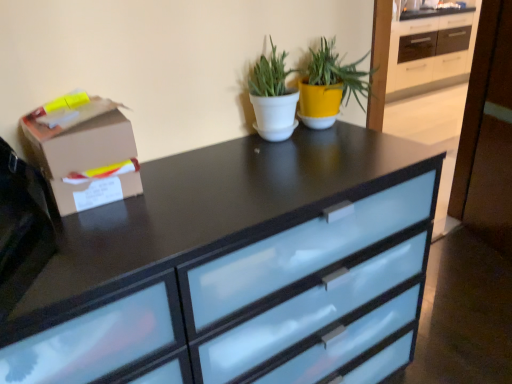
At what (x,y) coordinates should I click in order to perform the action: click on yellow matte pot at upper center, the 2th houseplant positioned from the left. Please return your answer as a coordinate pair (x, y). Looking at the image, I should click on (330, 82).

What is the approximate width of brown cardboard box at left?

It is 4.96 inches.

The image size is (512, 384). Describe the element at coordinates (238, 268) in the screenshot. I see `satin black chest of drawers at center` at that location.

You are a GUI agent. You are given a task and a screenshot of the screen. Output one action in this format:
    pyautogui.click(x=<x>, y=<y>)
    Task: Click on the yellow matte pot at upper center, the 2th houseplant positioned from the left
    The height and width of the screenshot is (384, 512).
    Given the screenshot: What is the action you would take?
    pyautogui.click(x=330, y=82)

I want to click on the 2nd houseplant behind the brown cardboard box at left, starting your count from the anchor, so click(330, 82).

Is yellow matte pot at upper center, the first houseplant in the right-to-left sequence, facing towards brown cardboard box at left?

No, yellow matte pot at upper center, the first houseplant in the right-to-left sequence, is not oriented towards brown cardboard box at left.

Looking at this image, which is less distant, (355, 93) or (57, 137)?

The point (57, 137) is in front.

Based on the photo, how distant is satin black chest of drawers at center from brown cardboard box at left?

A distance of 14.81 inches exists between satin black chest of drawers at center and brown cardboard box at left.

Is satin black chest of drawers at center at the right side of brown cardboard box at left?

Yes, satin black chest of drawers at center is to the right of brown cardboard box at left.

Is satin black chest of drawers at center in front of brown cardboard box at left?

Yes, satin black chest of drawers at center is closer to the viewer.

Is satin black chest of drawers at center taller or shorter than brown cardboard box at left?

Clearly, satin black chest of drawers at center is taller compared to brown cardboard box at left.

How different are the orientations of satin black chest of drawers at center and white matte pot at center, the second houseplant viewed from the right, in degrees?

satin black chest of drawers at center and white matte pot at center, the second houseplant viewed from the right, are facing 0.225 degrees away from each other.

Is point (65, 249) more distant than point (289, 92)?

No, (65, 249) is closer to viewer.

Does satin black chest of drawers at center have a greater height compared to white matte pot at center, which is counted as the first houseplant, starting from the left?

Yes.

Is satin black chest of drawers at center at the left side of white matte pot at center, the second houseplant viewed from the right?

Yes.

Where is `houseplant located above the white matte pot at center, the second houseplant viewed from the right (from a real-world perspective)`? houseplant located above the white matte pot at center, the second houseplant viewed from the right (from a real-world perspective) is located at coordinates (330, 82).

In the image, is white matte pot at center, the second houseplant viewed from the right, positioned in front of or behind yellow matte pot at upper center, the first houseplant in the right-to-left sequence?

white matte pot at center, the second houseplant viewed from the right, is positioned closer to the viewer than yellow matte pot at upper center, the first houseplant in the right-to-left sequence.

Which of these two, white matte pot at center, which is counted as the first houseplant, starting from the left, or yellow matte pot at upper center, the 2th houseplant positioned from the left, is thinner?

white matte pot at center, which is counted as the first houseplant, starting from the left, is thinner.

Does white matte pot at center, the second houseplant viewed from the right, have a larger size compared to yellow matte pot at upper center, the 2th houseplant positioned from the left?

No.

Identify the location of chest of drawers below the yellow matte pot at upper center, the first houseplant in the right-to-left sequence (from a real-world perspective). Image resolution: width=512 pixels, height=384 pixels. (238, 268).

Does point (396, 148) come closer to viewer compared to point (316, 115)?

No, it is not.

Considering the relative sizes of satin black chest of drawers at center and yellow matte pot at upper center, the 2th houseplant positioned from the left, in the image provided, is satin black chest of drawers at center shorter than yellow matte pot at upper center, the 2th houseplant positioned from the left,?

In fact, satin black chest of drawers at center may be taller than yellow matte pot at upper center, the 2th houseplant positioned from the left.

From a real-world perspective, which is physically below, satin black chest of drawers at center or yellow matte pot at upper center, the 2th houseplant positioned from the left?

From a 3D spatial view, satin black chest of drawers at center is below.

Is yellow matte pot at upper center, the first houseplant in the right-to-left sequence, wider than satin black chest of drawers at center?

No.

Which is behind, point (314, 55) or point (81, 315)?

The point (314, 55) is farther from the camera.

Is yellow matte pot at upper center, the first houseplant in the right-to-left sequence, completely or partially outside of satin black chest of drawers at center?

Yes, yellow matte pot at upper center, the first houseplant in the right-to-left sequence, is outside of satin black chest of drawers at center.

Who is smaller, yellow matte pot at upper center, the 2th houseplant positioned from the left, or satin black chest of drawers at center?

yellow matte pot at upper center, the 2th houseplant positioned from the left, is smaller.

Between brown cardboard box at left and white matte pot at center, the second houseplant viewed from the right, which one has smaller size?

white matte pot at center, the second houseplant viewed from the right, is smaller.

Would you say brown cardboard box at left is to the left or to the right of white matte pot at center, the second houseplant viewed from the right, in the picture?

In the image, brown cardboard box at left appears on the left side of white matte pot at center, the second houseplant viewed from the right.

From the image's perspective, is brown cardboard box at left positioned above or below white matte pot at center, the second houseplant viewed from the right?

brown cardboard box at left is situated lower than white matte pot at center, the second houseplant viewed from the right, in the image.

Locate an element on the screen. the 1st houseplant above the brown cardboard box at left (from a real-world perspective) is located at coordinates (272, 96).

The height and width of the screenshot is (384, 512). I want to click on the 2nd houseplant to the right when counting from the brown cardboard box at left, so click(330, 82).

This screenshot has width=512, height=384. Find the location of `cardboard box that is above the satin black chest of drawers at center (from a real-world perspective)`. cardboard box that is above the satin black chest of drawers at center (from a real-world perspective) is located at coordinates (85, 153).

Based on their spatial positions, is satin black chest of drawers at center or yellow matte pot at upper center, the first houseplant in the right-to-left sequence, further from white matte pot at center, the second houseplant viewed from the right?

satin black chest of drawers at center is positioned further to the anchor white matte pot at center, the second houseplant viewed from the right.

When comparing their distances from yellow matte pot at upper center, the 2th houseplant positioned from the left, does white matte pot at center, the second houseplant viewed from the right, or brown cardboard box at left seem further?

brown cardboard box at left lies further to yellow matte pot at upper center, the 2th houseplant positioned from the left, than the other object.

Based on their spatial positions, is yellow matte pot at upper center, the 2th houseplant positioned from the left, or white matte pot at center, the second houseplant viewed from the right, further from brown cardboard box at left?

yellow matte pot at upper center, the 2th houseplant positioned from the left, is positioned further to the anchor brown cardboard box at left.

Based on their spatial positions, is brown cardboard box at left or white matte pot at center, which is counted as the first houseplant, starting from the left, further from yellow matte pot at upper center, the first houseplant in the right-to-left sequence?

brown cardboard box at left is positioned further to the anchor yellow matte pot at upper center, the first houseplant in the right-to-left sequence.

Based on their spatial positions, is white matte pot at center, the second houseplant viewed from the right, or yellow matte pot at upper center, the first houseplant in the right-to-left sequence, closer to brown cardboard box at left?

white matte pot at center, the second houseplant viewed from the right.

Estimate the real-world distances between objects in this image. Which object is further from satin black chest of drawers at center, yellow matte pot at upper center, the first houseplant in the right-to-left sequence, or brown cardboard box at left?

The object further to satin black chest of drawers at center is yellow matte pot at upper center, the first houseplant in the right-to-left sequence.

Estimate the real-world distances between objects in this image. Which object is closer to white matte pot at center, the second houseplant viewed from the right, brown cardboard box at left or yellow matte pot at upper center, the 2th houseplant positioned from the left?

Based on the image, yellow matte pot at upper center, the 2th houseplant positioned from the left, appears to be nearer to white matte pot at center, the second houseplant viewed from the right.

From the image, which object appears to be farther from brown cardboard box at left, yellow matte pot at upper center, the 2th houseplant positioned from the left, or satin black chest of drawers at center?

The object further to brown cardboard box at left is yellow matte pot at upper center, the 2th houseplant positioned from the left.

At what (x,y) coordinates should I click in order to perform the action: click on cardboard box between yellow matte pot at upper center, the first houseplant in the right-to-left sequence, and satin black chest of drawers at center from top to bottom. Please return your answer as a coordinate pair (x, y). Looking at the image, I should click on (85, 153).

You are a GUI agent. You are given a task and a screenshot of the screen. Output one action in this format:
    pyautogui.click(x=<x>, y=<y>)
    Task: Click on the houseplant situated between brown cardboard box at left and yellow matte pot at upper center, the 2th houseplant positioned from the left, from left to right
    This screenshot has height=384, width=512.
    Given the screenshot: What is the action you would take?
    pyautogui.click(x=272, y=96)

The height and width of the screenshot is (384, 512). In order to click on houseplant between yellow matte pot at upper center, the 2th houseplant positioned from the left, and satin black chest of drawers at center from top to bottom in this screenshot , I will do `click(272, 96)`.

At what (x,y) coordinates should I click in order to perform the action: click on cardboard box between white matte pot at center, the second houseplant viewed from the right, and satin black chest of drawers at center in the up-down direction. Please return your answer as a coordinate pair (x, y). Looking at the image, I should click on (85, 153).